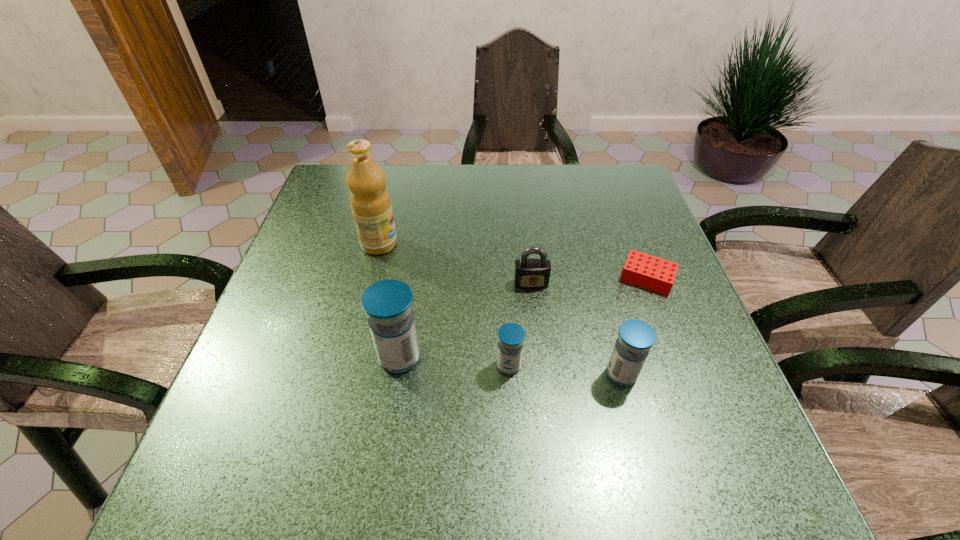
Identify the location of vacant space located 0.190m on the left of the leftmost medicine. This screenshot has height=540, width=960. (x=281, y=357).

Image resolution: width=960 pixels, height=540 pixels. I want to click on free space located 0.260m on the left of the shortest medicine, so pos(362,366).

Where is `free space located 0.050m on the back of the rightmost medicine`? This screenshot has width=960, height=540. free space located 0.050m on the back of the rightmost medicine is located at coordinates (612, 340).

You are a GUI agent. You are given a task and a screenshot of the screen. Output one action in this format:
    pyautogui.click(x=<x>, y=<y>)
    Task: Click on the free spot located on the front of the padlock near the keyhole
    The image size is (960, 540).
    Given the screenshot: What is the action you would take?
    pyautogui.click(x=536, y=325)

Image resolution: width=960 pixels, height=540 pixels. Identify the location of vacant space situated 0.170m on the label of the farthest object. (465, 244).

Where is `vacant space positioned on the back of the rightmost object`? vacant space positioned on the back of the rightmost object is located at coordinates (613, 188).

At what (x,y) coordinates should I click in order to perform the action: click on object positioned at the left edge. Please return your answer as a coordinate pair (x, y). Looking at the image, I should click on (370, 203).

Where is `medicine that is at the right edge`? The height and width of the screenshot is (540, 960). medicine that is at the right edge is located at coordinates (635, 338).

Locate an element on the screen. Lego at the right edge is located at coordinates (647, 271).

Identify the location of free spot at the far edge of the desktop. Image resolution: width=960 pixels, height=540 pixels. (581, 202).